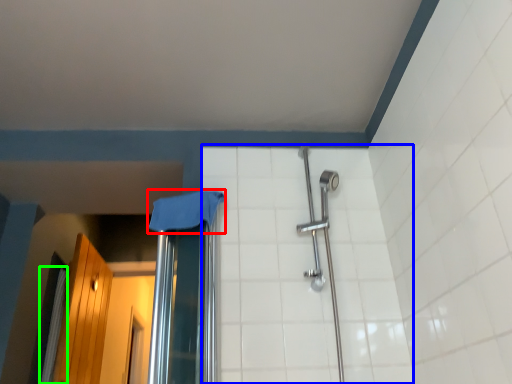
Question: Which is farther away from cloth (highlighted by a red box)? ceramic tile (highlighted by a blue box) or shower curtain (highlighted by a green box)?

Choices:
 (A) ceramic tile
 (B) shower curtain

Answer: (B)